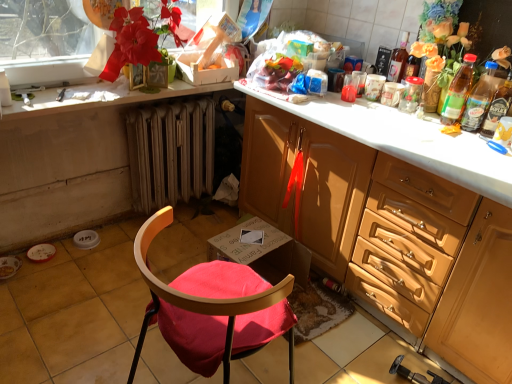
Image resolution: width=512 pixels, height=384 pixels. I want to click on free spot in front of translucent plastic bottle at upper right, which ranks as the 2th bottle in left-to-right order, so click(x=458, y=136).